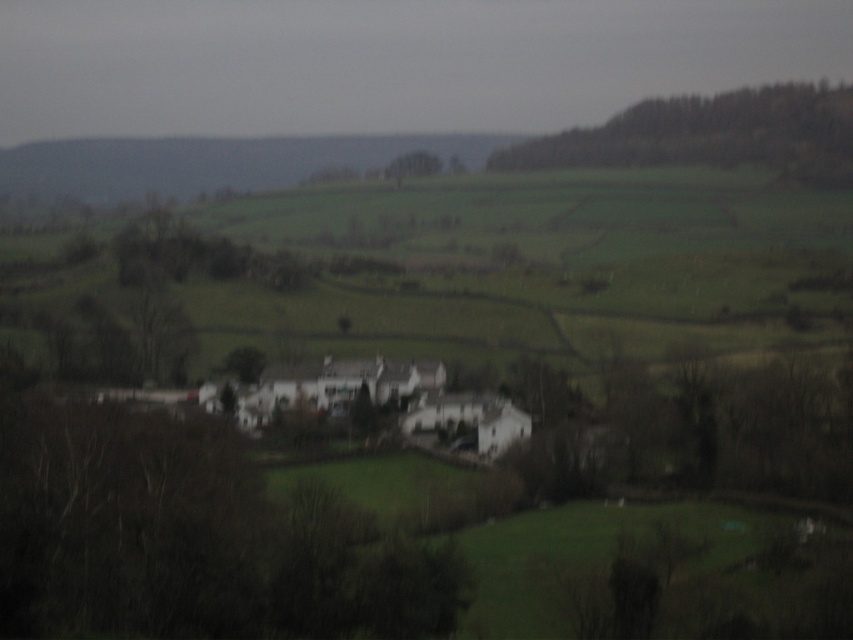
Question: Which of the following is the closest to the observer?

Choices:
 (A) (157, 483)
 (B) (392, 170)
 (C) (824, 154)
 (D) (701, 220)

Answer: (A)

Question: Is green leafy trees at upper right above green leafy tree at center?

Choices:
 (A) no
 (B) yes

Answer: (B)

Question: Considering the real-world distances, which object is closest to the green leafy tree at center?

Choices:
 (A) green leafy trees at upper right
 (B) green grassy hillside at center

Answer: (A)

Question: Which point is farther to the camera?

Choices:
 (A) (340, 572)
 (B) (381, 324)

Answer: (B)

Question: Is green grassy hillside at center above green leafy trees at upper right?

Choices:
 (A) no
 (B) yes

Answer: (A)

Question: Can you confirm if green leafy tree at lower left is positioned to the left of green leafy trees at upper right?

Choices:
 (A) no
 (B) yes

Answer: (B)